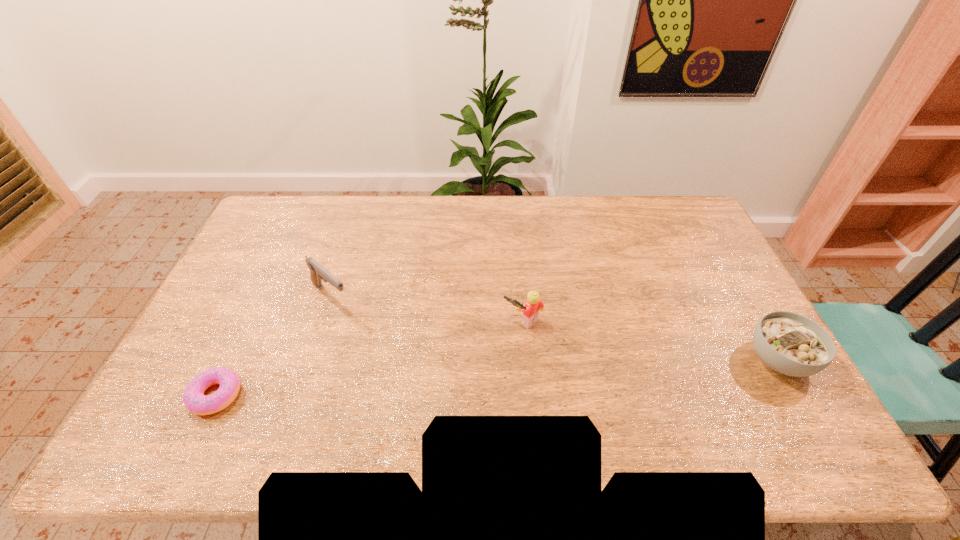
This screenshot has height=540, width=960. What are the coordinates of `object that is positioned at the near right corner` in the screenshot? It's located at (789, 343).

You are a GUI agent. You are given a task and a screenshot of the screen. Output one action in this format:
    pyautogui.click(x=<x>, y=<y>)
    Task: Click on the free space at the far edge of the desktop
    The width and height of the screenshot is (960, 540).
    Given the screenshot: What is the action you would take?
    pyautogui.click(x=388, y=202)

Find the location of a particular element. This screenshot has height=540, width=960. blank space at the near edge is located at coordinates (623, 395).

At what (x,y) coordinates should I click in order to perform the action: click on free space at the left edge of the desktop. Please return your answer as a coordinate pair (x, y). The height and width of the screenshot is (540, 960). Looking at the image, I should click on (291, 241).

I want to click on blank space at the right edge of the desktop, so click(x=728, y=308).

In the image, there is a desktop. At what (x,y) coordinates should I click in order to perform the action: click on free region at the far left corner. Please return your answer as a coordinate pair (x, y). Looking at the image, I should click on (269, 208).

The width and height of the screenshot is (960, 540). I want to click on free space at the near right corner of the desktop, so click(738, 392).

In order to click on blank region between the Lego and the farthest object in this screenshot , I will do `click(427, 309)`.

Where is `free area in between the pistol and the doughnut`? Image resolution: width=960 pixels, height=540 pixels. free area in between the pistol and the doughnut is located at coordinates (274, 345).

This screenshot has width=960, height=540. I want to click on free space that is in between the third nearest object and the leftmost object, so click(370, 359).